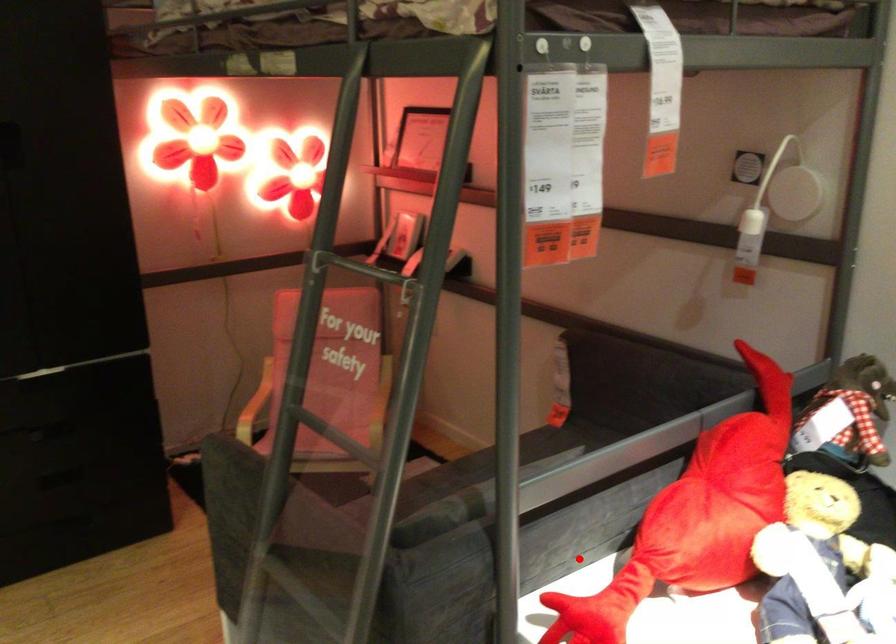
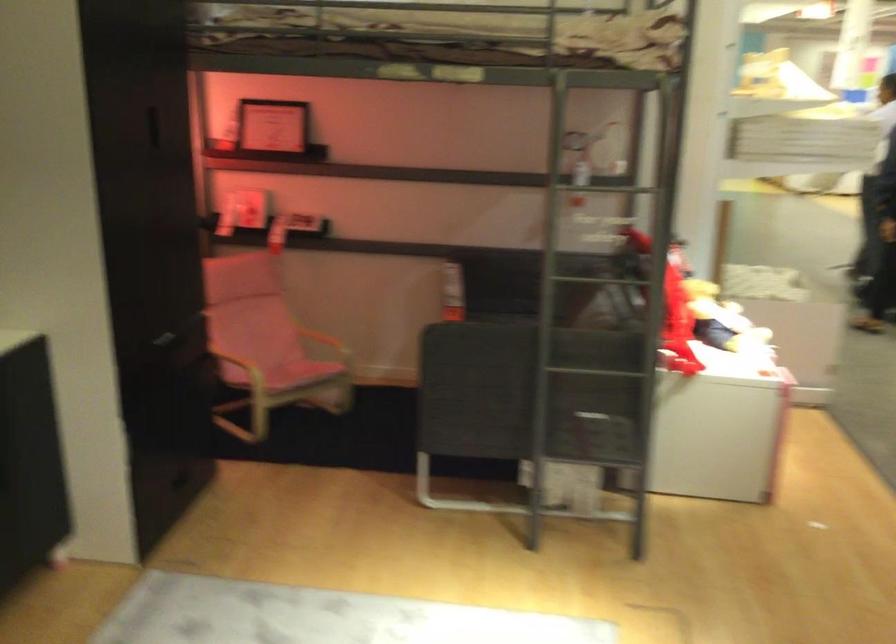
Locate, in the second image, the point that corresponds to the highlighted location in the first image.

(677, 325)